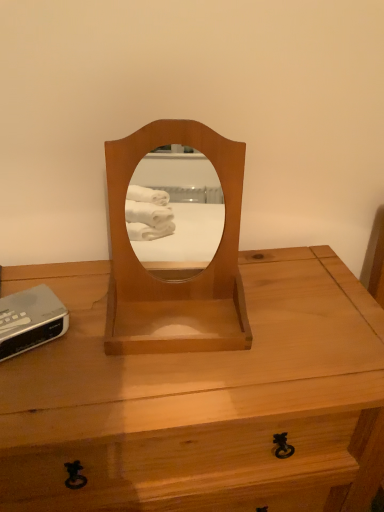
Image resolution: width=384 pixels, height=512 pixels. I want to click on free space in front of light brown wood mirror at center, so click(x=157, y=392).